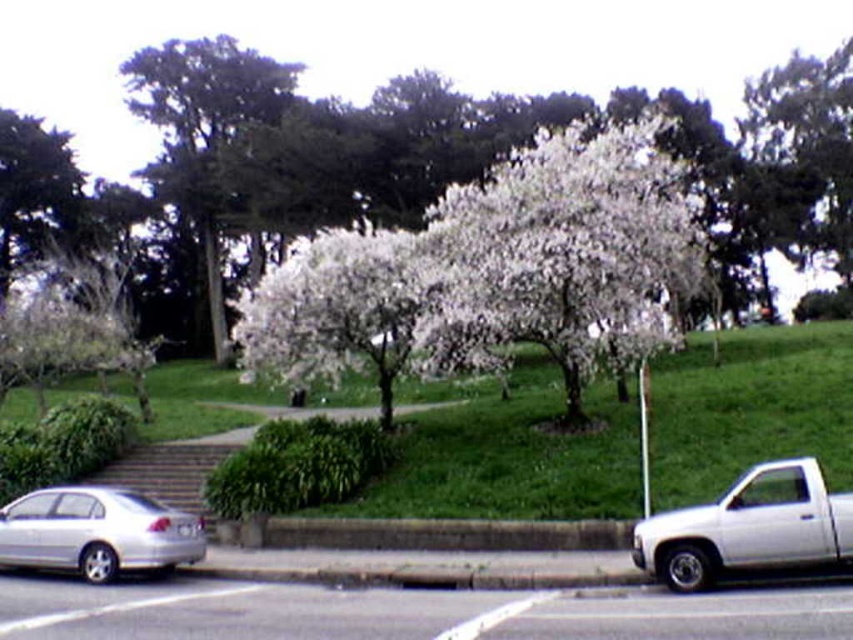
A delivery person needs to walk from the silver sedan on the left to the white pickup truck on the right. The path goes through the white blossoms at center. What is the total distance they need to walk?

The total distance from the silver sedan on the left to the white pickup truck on the right through the white blossoms at center is 18.10 meters.

Looking at this image, you are standing at the center of the paved road and want to walk towards the green leafy tree at upper left. In which general direction should you head?

You should head towards the upper left direction to reach the green leafy tree at upper left, as its 2D location is at point (206,134).

You are a gardener who wants to plant a new tree in the center of the image. There is already a white blossoms at center and a white matte truck at lower right. Which object occupies more space in the center area?

The white blossoms at center is bigger than the white matte truck at lower right, so the white blossoms at center occupies more space in the center area.